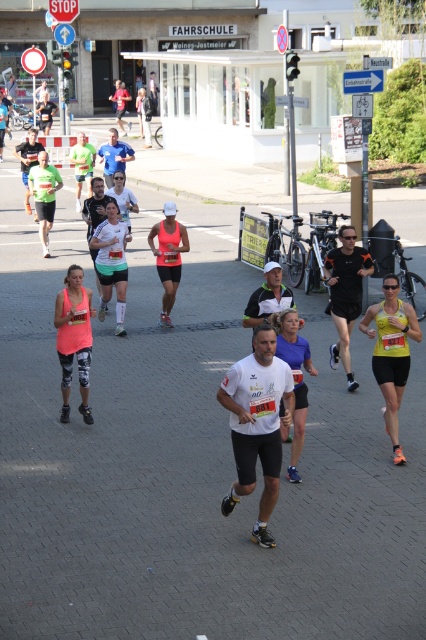
Does matte black leggings at center appear on the left side of matte blue shorts at center?

Answer: Yes, matte black leggings at center is to the left of matte blue shorts at center.

Who is positioned more to the right, matte black leggings at center or matte blue shorts at center?

matte blue shorts at center is more to the right.

What do you see at coordinates (74, 339) in the screenshot?
I see `matte black leggings at center` at bounding box center [74, 339].

The image size is (426, 640). I want to click on matte black leggings at center, so click(74, 339).

Is yellow fabric runner at center bigger than pink matte tank top at center?

No.

Is point (377, 365) less distant than point (169, 205)?

Yes, point (377, 365) is closer to viewer.

At what (x,y) coordinates should I click in order to perform the action: click on yellow fabric runner at center. Please return your answer as a coordinate pair (x, y). Looking at the image, I should click on (391, 352).

Measure the distance between point (115,285) and camera.

A distance of 37.86 feet exists between point (115,285) and camera.

Which is more to the left, white matte running outfit at center or pink matte tank top at center?

Positioned to the left is white matte running outfit at center.

In order to click on white matte running outfit at center in this screenshot , I will do `click(112, 260)`.